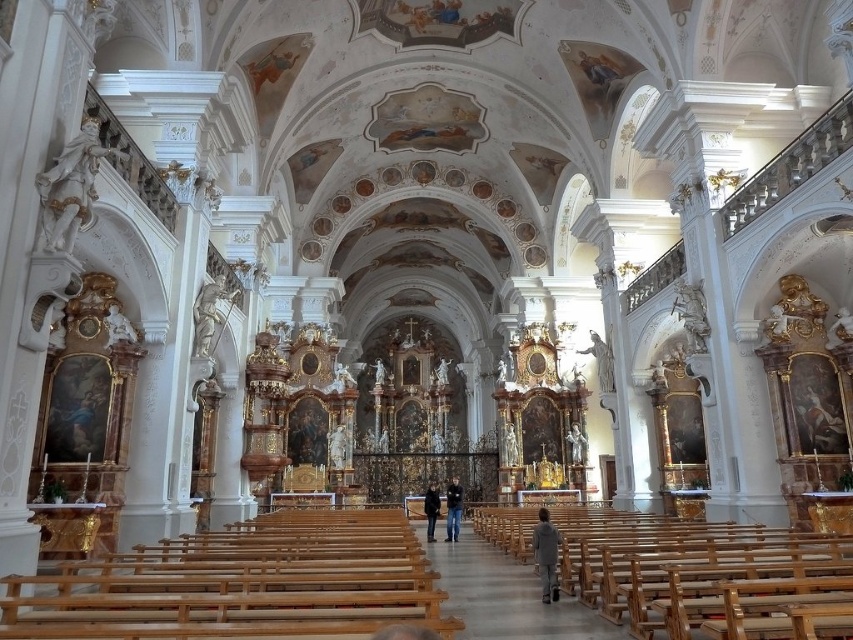
Does dark blue jeans at center lie behind black leather jacket at center?

Yes.

Is dark blue jeans at center smaller than black leather jacket at center?

No, dark blue jeans at center is not smaller than black leather jacket at center.

Which is in front, point (450, 499) or point (428, 516)?

Point (428, 516)

Where is `dark blue jeans at center`? dark blue jeans at center is located at coordinates (453, 509).

Is point (546, 515) closer to camera compared to point (457, 512)?

Yes, point (546, 515) is closer to viewer.

How much distance is there between gray fabric jacket at lower center and dark blue jeans at center?

gray fabric jacket at lower center and dark blue jeans at center are 38.50 meters apart from each other.

Between point (543, 557) and point (459, 522), which one is positioned behind?

The point (459, 522) is more distant.

Locate an element on the screen. This screenshot has width=853, height=640. gray fabric jacket at lower center is located at coordinates (546, 554).

How distant is gray fabric jacket at lower center from black leather jacket at center?

gray fabric jacket at lower center is 132.83 feet from black leather jacket at center.

Locate an element on the screen. The image size is (853, 640). gray fabric jacket at lower center is located at coordinates (546, 554).